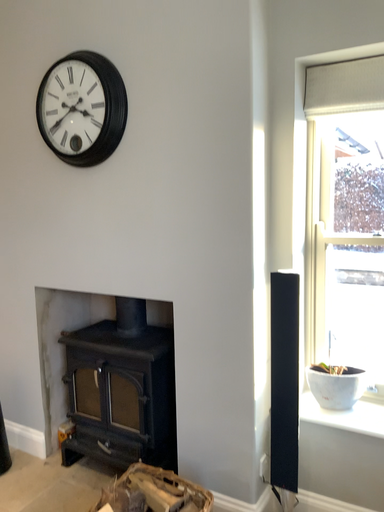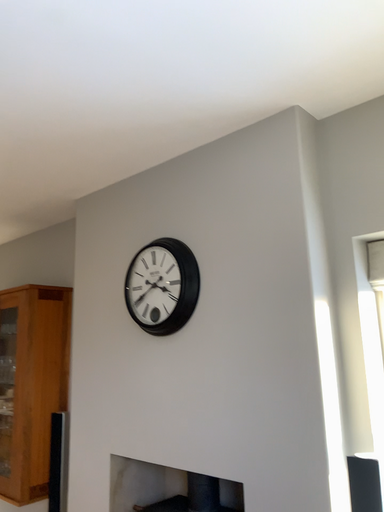
Question: How did the camera likely rotate when shooting the video?

Choices:
 (A) rotated downward
 (B) rotated upward

Answer: (B)